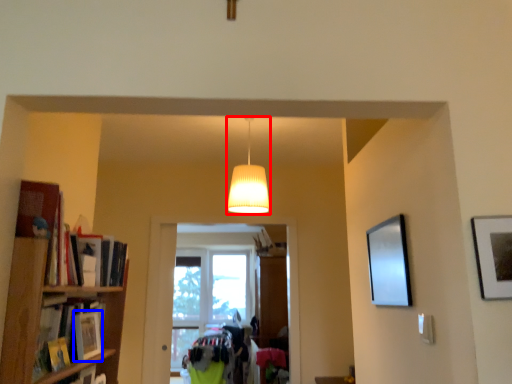
Question: Which object is closer to the camera taking this photo, lamp (highlighted by a red box) or book (highlighted by a blue box)?

Choices:
 (A) lamp
 (B) book

Answer: (B)